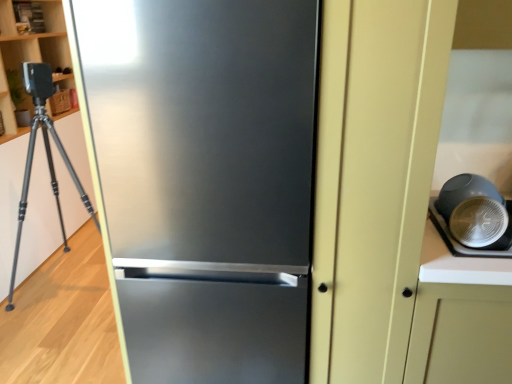
Question: Does stainless steel refrigerator at center have a larger size compared to matte black bowl at right?

Choices:
 (A) yes
 (B) no

Answer: (A)

Question: Is matte black bowl at right located within stainless steel refrigerator at center?

Choices:
 (A) yes
 (B) no

Answer: (B)

Question: Can you confirm if stainless steel refrigerator at center is positioned to the right of matte black bowl at right?

Choices:
 (A) no
 (B) yes

Answer: (A)

Question: Is stainless steel refrigerator at center not close to matte black bowl at right?

Choices:
 (A) yes
 (B) no

Answer: (B)

Question: From a real-world perspective, is stainless steel refrigerator at center located higher than matte black bowl at right?

Choices:
 (A) yes
 (B) no

Answer: (B)

Question: Could you tell me if stainless steel refrigerator at center is turned towards matte black bowl at right?

Choices:
 (A) no
 (B) yes

Answer: (A)

Question: Is matte black bowl at right not inside stainless steel refrigerator at center?

Choices:
 (A) yes
 (B) no

Answer: (A)

Question: Could you tell me if matte black bowl at right is turned towards stainless steel refrigerator at center?

Choices:
 (A) yes
 (B) no

Answer: (B)

Question: Is matte black bowl at right at the left side of stainless steel refrigerator at center?

Choices:
 (A) no
 (B) yes

Answer: (A)

Question: From a real-world perspective, is matte black bowl at right physically above stainless steel refrigerator at center?

Choices:
 (A) yes
 (B) no

Answer: (A)

Question: Is matte black bowl at right turned away from stainless steel refrigerator at center?

Choices:
 (A) yes
 (B) no

Answer: (A)

Question: Is matte black bowl at right in contact with stainless steel refrigerator at center?

Choices:
 (A) yes
 (B) no

Answer: (B)

Question: Looking at the image, does stainless steel refrigerator at center seem bigger or smaller compared to matte black bowl at right?

Choices:
 (A) big
 (B) small

Answer: (A)